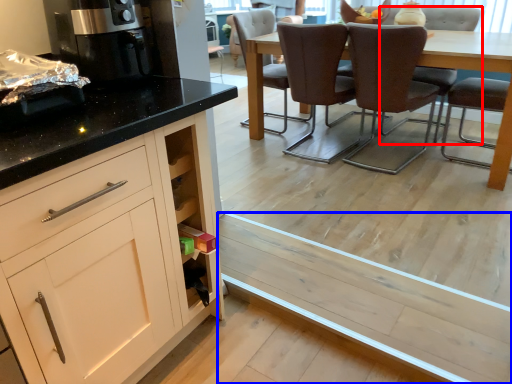
Question: Which of the following is the farthest to the observer, chair (highlighted by a red box) or plank (highlighted by a blue box)?

Choices:
 (A) chair
 (B) plank

Answer: (A)